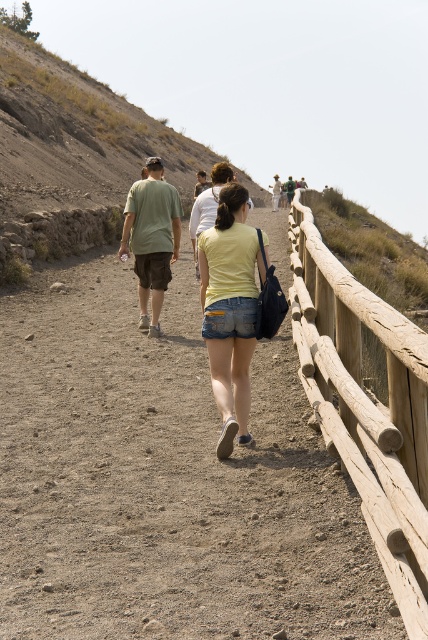
Question: Does wooden at right come behind white cotton shirt at center?

Choices:
 (A) no
 (B) yes

Answer: (A)

Question: Does brown wooden fence at center-right appear on the left side of wooden at right?

Choices:
 (A) no
 (B) yes

Answer: (B)

Question: Is denim shorts at center closer to the viewer compared to matte green t-shirt at center?

Choices:
 (A) no
 (B) yes

Answer: (B)

Question: Among these objects, which one is nearest to the camera?

Choices:
 (A) dull brown dirt at upper left
 (B) white cotton shirt at center
 (C) matte green t-shirt at center

Answer: (C)

Question: Which point is farther from the camera taking this photo?

Choices:
 (A) pyautogui.click(x=422, y=394)
 (B) pyautogui.click(x=222, y=595)
 (C) pyautogui.click(x=148, y=227)
 (D) pyautogui.click(x=229, y=360)

Answer: (C)

Question: Which of the following is the farthest from the observer?

Choices:
 (A) (151, 204)
 (B) (59, 131)

Answer: (B)